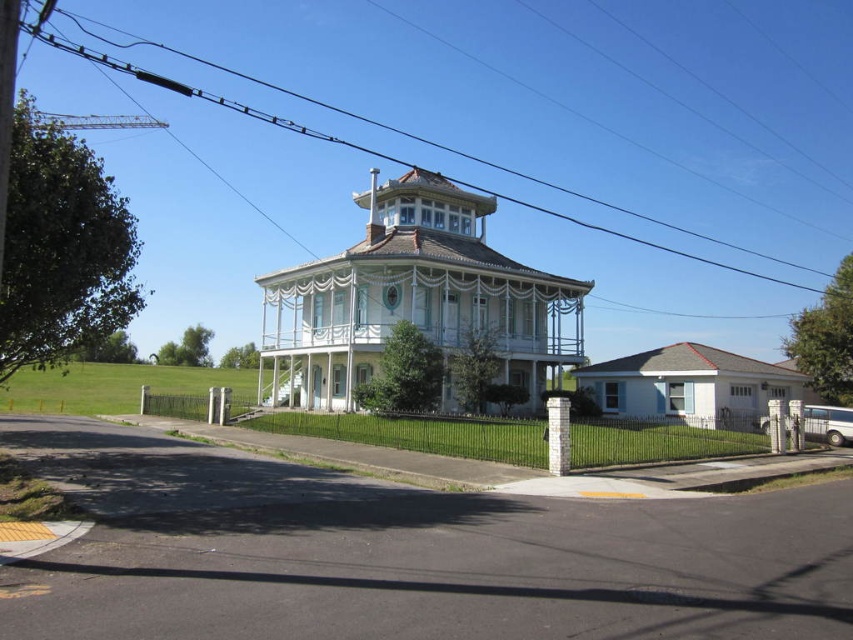
Question: Among these objects, which one is nearest to the camera?

Choices:
 (A) white stone column at center
 (B) white painted wood post at center
 (C) black wire at upper center
 (D) white wood gazebo at center

Answer: (A)

Question: Which object is the closest to the white painted wood post at center?

Choices:
 (A) white stone column at center
 (B) black wire at upper center

Answer: (A)

Question: Is white wood gazebo at center behind white painted wood post at center?

Choices:
 (A) yes
 (B) no

Answer: (A)

Question: Which of the following is the closest to the observer?

Choices:
 (A) white painted wood post at center
 (B) black wire at upper center

Answer: (A)

Question: Does white wood gazebo at center appear under black wire at upper center?

Choices:
 (A) yes
 (B) no

Answer: (A)

Question: Does white wood gazebo at center have a lesser width compared to black wire at upper center?

Choices:
 (A) yes
 (B) no

Answer: (A)